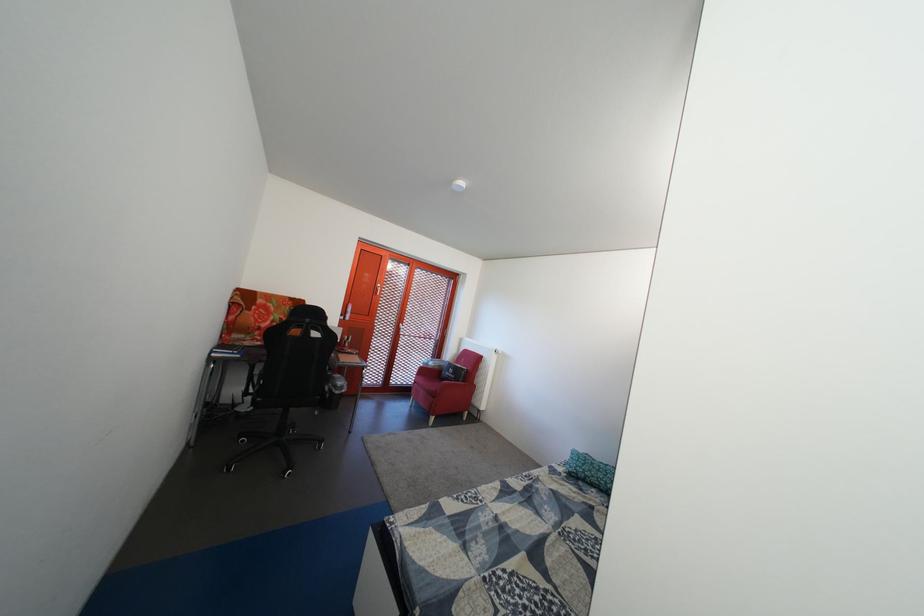
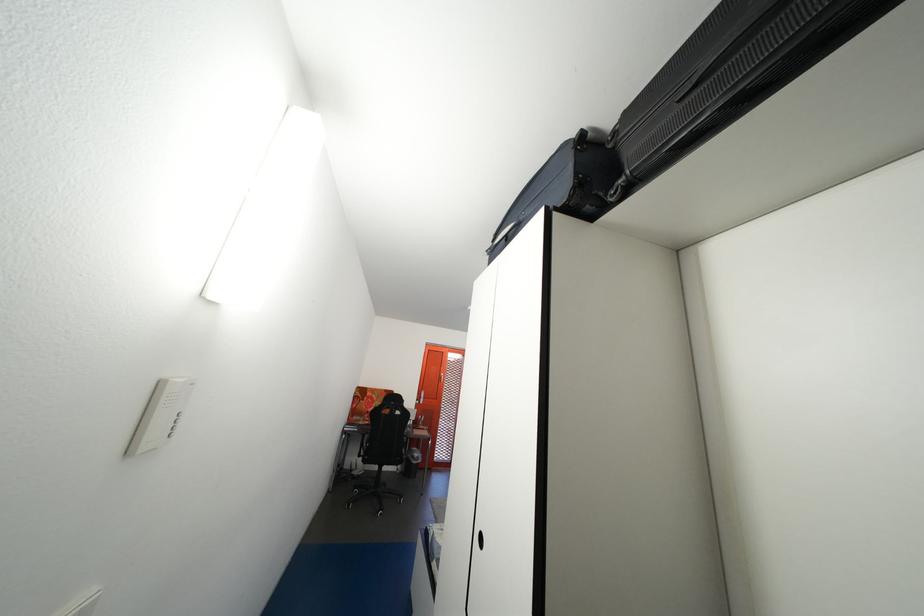
In the second image, find the point that corresponds to the point at 246,342 in the first image.

(367, 424)